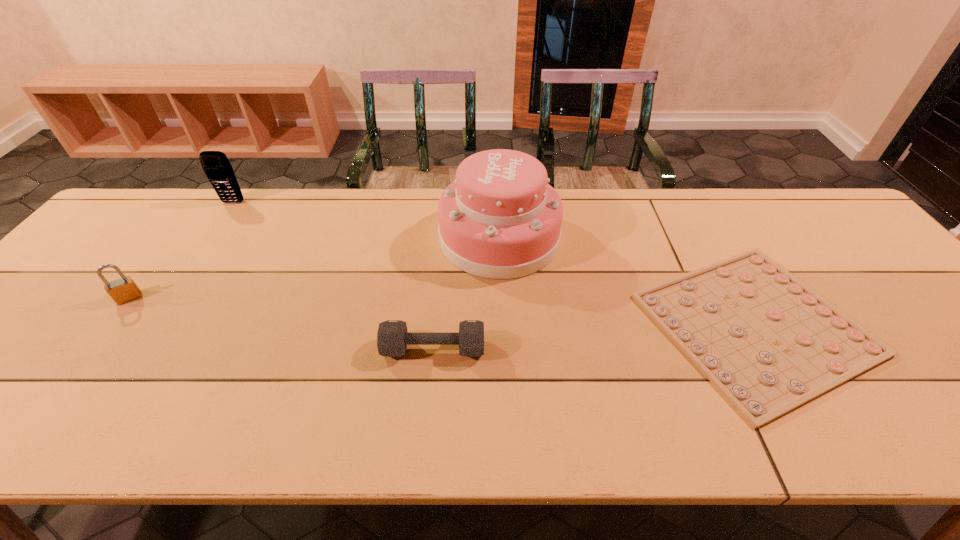
This screenshot has height=540, width=960. In order to click on free space at the far left corner in this screenshot , I will do `click(150, 225)`.

At what (x,y) coordinates should I click in order to perform the action: click on blank space at the far right corner. Please return your answer as a coordinate pair (x, y). The height and width of the screenshot is (540, 960). Looking at the image, I should click on pos(831,209).

Find the location of a particular element. This screenshot has width=960, height=540. free spot between the fourth tallest object and the shortest object is located at coordinates (594, 336).

Locate an element on the screen. free space between the third tallest object and the dumbbell is located at coordinates (281, 323).

At what (x,y) coordinates should I click in order to perform the action: click on free spot between the dumbbell and the tallest object. Please return your answer as a coordinate pair (x, y). The width and height of the screenshot is (960, 540). Looking at the image, I should click on (467, 293).

What are the coordinates of `unoccupied area between the birthday cake and the third shortest object` in the screenshot? It's located at (314, 268).

Where is `free spot between the birthday cake and the fourth object from right to left`? free spot between the birthday cake and the fourth object from right to left is located at coordinates (366, 220).

The image size is (960, 540). Identify the location of empty space between the leftmost object and the dumbbell. (281, 323).

Locate an element on the screen. This screenshot has width=960, height=540. empty location between the tallest object and the padlock is located at coordinates [x=314, y=268].

Where is `empty space that is in between the leftmost object and the tallest object`? This screenshot has width=960, height=540. empty space that is in between the leftmost object and the tallest object is located at coordinates (314, 268).